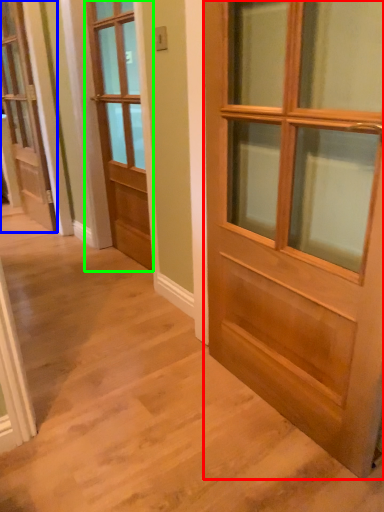
Question: Estimate the real-world distances between objects in this image. Which object is farther from door (highlighted by a red box), door (highlighted by a blue box) or door (highlighted by a green box)?

Choices:
 (A) door
 (B) door

Answer: (A)